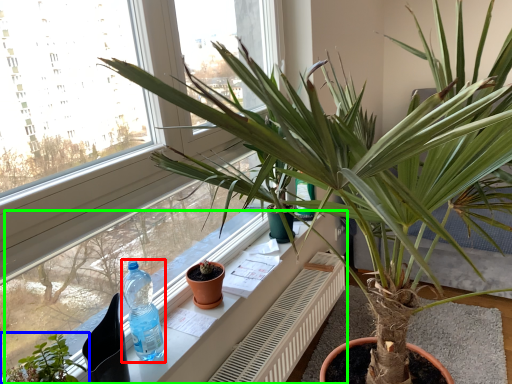
Question: Estimate the real-world distances between objects in this image. Which object is closer to bottle (highlighted by a red box), houseplant (highlighted by a blue box) or window sill (highlighted by a green box)?

Choices:
 (A) houseplant
 (B) window sill

Answer: (B)